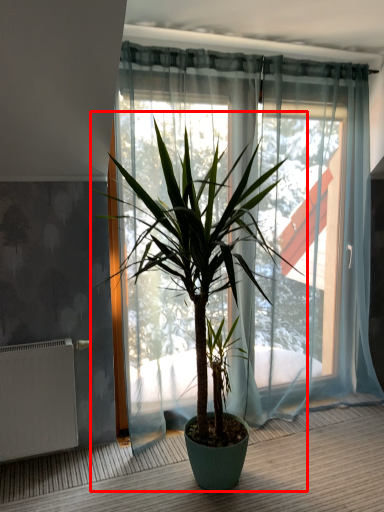
Question: From the image's perspective, where is houseplant (annotated by the red box) located in relation to radiator in the image?

Choices:
 (A) below
 (B) above

Answer: (B)